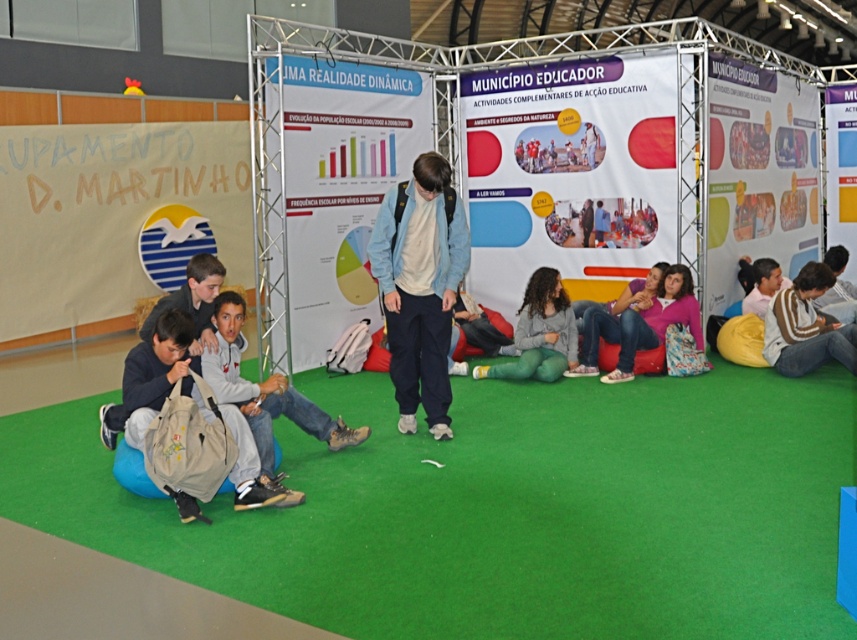
You are at an event and want to borrow a jacket. You see a denim jacket at center and a gray fleece sweater at center. Which one is closer to your left side?

The denim jacket at center is to the left of the gray fleece sweater at center, so it is closer to your left side.

You are standing in the indoor event area and need to determine which of the two points, point (402, 349) or point (520, 321), is closer to you. Based on the scene description, which point is nearer?

Point (402, 349) is closer to the viewer than point (520, 321).

You are organizing a small event and need to place a 3.5 feet wide table between the denim jacket at center and the gray fleece sweater at center. Can the table fit between them?

The denim jacket at center is 6.11 feet away from the gray fleece sweater at center. Since the table is 3.5 feet wide, it can fit between them as the distance between the two objects is greater than the table width.